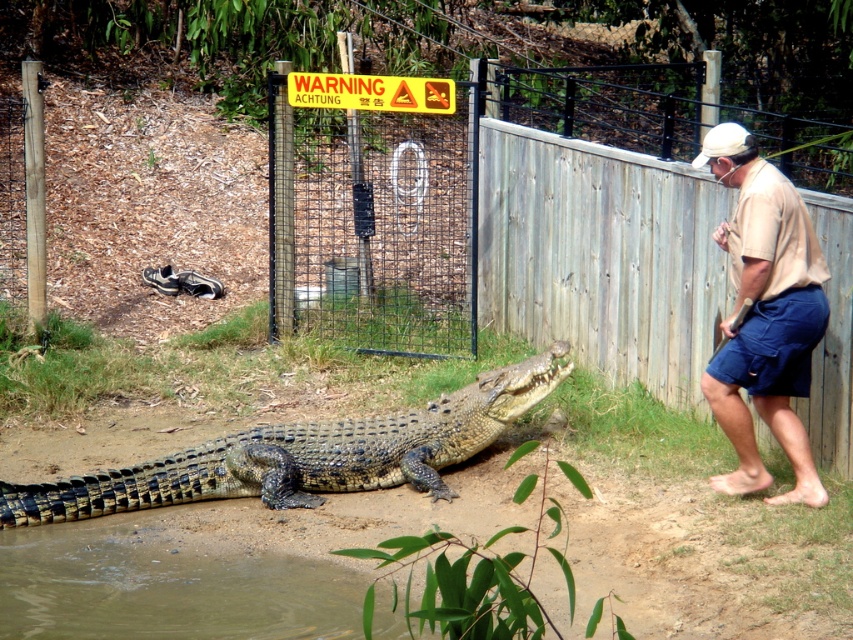
Question: Considering the relative positions of shiny dark green scales at center and beige cotton shirt at right in the image provided, where is shiny dark green scales at center located with respect to beige cotton shirt at right?

Choices:
 (A) left
 (B) right

Answer: (A)

Question: Which object is farther from the camera taking this photo?

Choices:
 (A) shiny dark green scales at center
 (B) beige cotton shirt at right
 (C) blue cotton shorts at right

Answer: (A)

Question: Which of the following is the closest to the observer?

Choices:
 (A) (42, 614)
 (B) (444, 452)
 (C) (718, 388)

Answer: (A)

Question: Where is shiny dark green scales at center located in relation to blue cotton shorts at right in the image?

Choices:
 (A) above
 (B) below

Answer: (B)

Question: Which point is closer to the camera?

Choices:
 (A) (389, 452)
 (B) (318, 314)

Answer: (A)

Question: Is shiny dark green scales at center above beige cotton shirt at right?

Choices:
 (A) yes
 (B) no

Answer: (B)